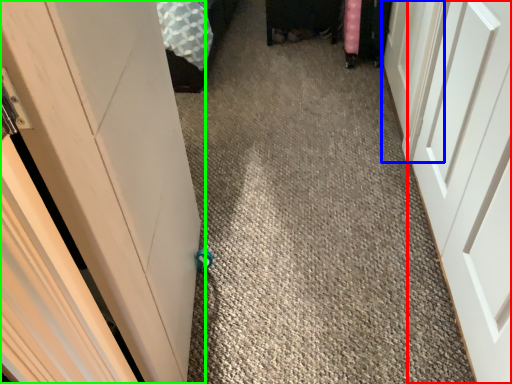
Question: Considering the real-world distances, which object is closest to door (highlighted by a red box)? door (highlighted by a blue box) or door (highlighted by a green box).

Choices:
 (A) door
 (B) door

Answer: (A)